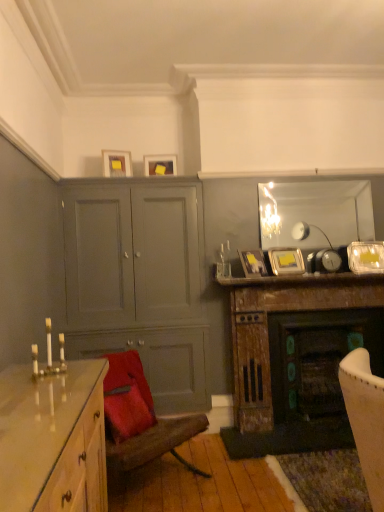
The width and height of the screenshot is (384, 512). I want to click on free space in front of gold metallic candle holder at left, so click(27, 390).